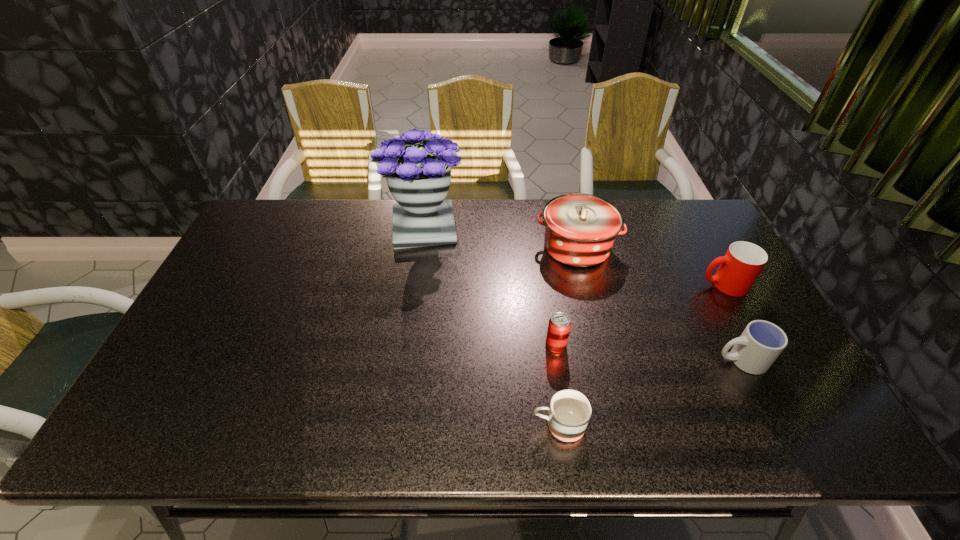
Where is `blank area located on the left of the second tallest object`? The image size is (960, 540). blank area located on the left of the second tallest object is located at coordinates (476, 247).

Identify the location of free location located on the side of the farther cup with the handle. (572, 285).

This screenshot has height=540, width=960. Identify the location of vacant region located 0.100m on the side of the farther cup with the handle. click(x=666, y=285).

Identify the location of vacant area located on the side of the farther cup with the handle. The width and height of the screenshot is (960, 540). (666, 285).

Identify the location of free space located with the handle on the side of the shorter cup. (578, 360).

The image size is (960, 540). I want to click on free space located with the handle on the side of the shorter cup, so click(645, 360).

Locate an element on the screen. This screenshot has height=540, width=960. vacant area located 0.050m with the handle on the side of the shorter cup is located at coordinates (696, 360).

Locate an element on the screen. The width and height of the screenshot is (960, 540). blank space located 0.210m on the right of the can is located at coordinates (646, 345).

Identify the location of vacant space positioned 0.120m on the side with the handle of the shortest object. [x=479, y=426].

At what (x,y) coordinates should I click in order to perform the action: click on free region located on the side with the handle of the shortest object. Please return your answer as a coordinate pair (x, y). Image resolution: width=960 pixels, height=540 pixels. Looking at the image, I should click on (444, 426).